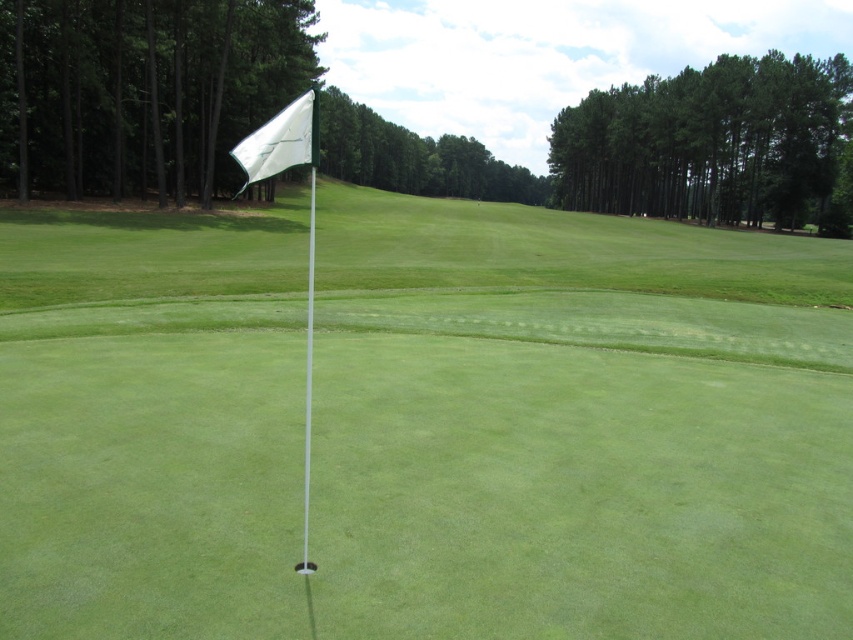
Question: Among these points, which one is nearest to the camera?

Choices:
 (A) (288, 150)
 (B) (318, 531)

Answer: (A)

Question: Is white fabric flag at upper center above white glossy flag at center?

Choices:
 (A) yes
 (B) no

Answer: (B)

Question: Which object is the farthest from the white fabric flag at upper center?

Choices:
 (A) white fabric flag at center
 (B) white glossy flag at center

Answer: (A)

Question: Does white fabric flag at center have a lesser width compared to white fabric flag at upper center?

Choices:
 (A) no
 (B) yes

Answer: (A)

Question: Does white fabric flag at center have a larger size compared to white glossy flag at center?

Choices:
 (A) yes
 (B) no

Answer: (B)

Question: Based on their relative distances, which object is nearer to the white glossy flag at center?

Choices:
 (A) white fabric flag at center
 (B) white fabric flag at upper center

Answer: (A)